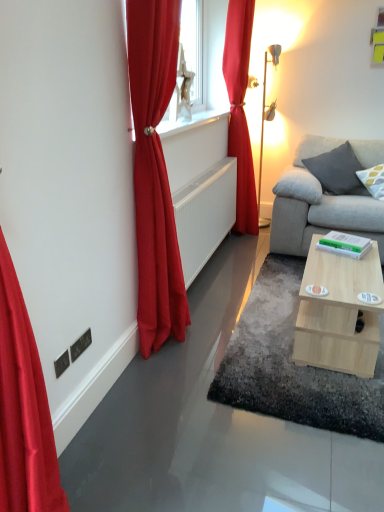
Question: In terms of width, does satin red curtain at left, which ranks as the second curtain in back-to-front order, look wider or thinner when compared to gray fabric pillow at right, the first pillow in the left-to-right sequence?

Choices:
 (A) thin
 (B) wide

Answer: (A)

Question: Is satin red curtain at left, positioned as the 1th curtain in front-to-back order, to the left or to the right of gray fabric pillow at right, the first pillow in the left-to-right sequence, in the image?

Choices:
 (A) right
 (B) left

Answer: (B)

Question: Which of these objects is positioned closest to the gray fabric pillow at right, positioned as the first pillow in right-to-left order?

Choices:
 (A) satin red curtain at upper right, which is counted as the 1th curtain, starting from the back
 (B) gray fabric pillow at right, placed as the second pillow when sorted from right to left
 (C) metallic gold table lamp at right
 (D) satin red curtain at left, which appears as the first curtain when viewed from the left
 (E) white metallic radiator at center

Answer: (B)

Question: Which of these objects is positioned closest to the white metallic radiator at center?

Choices:
 (A) light wood/texture coffee table at lower right
 (B) gray fabric pillow at right, placed as the second pillow when sorted from right to left
 (C) metallic gold table lamp at right
 (D) satin red curtain at left, which appears as the first curtain when viewed from the left
 (E) satin red curtain at upper right, the 1th curtain from the right

Answer: (E)